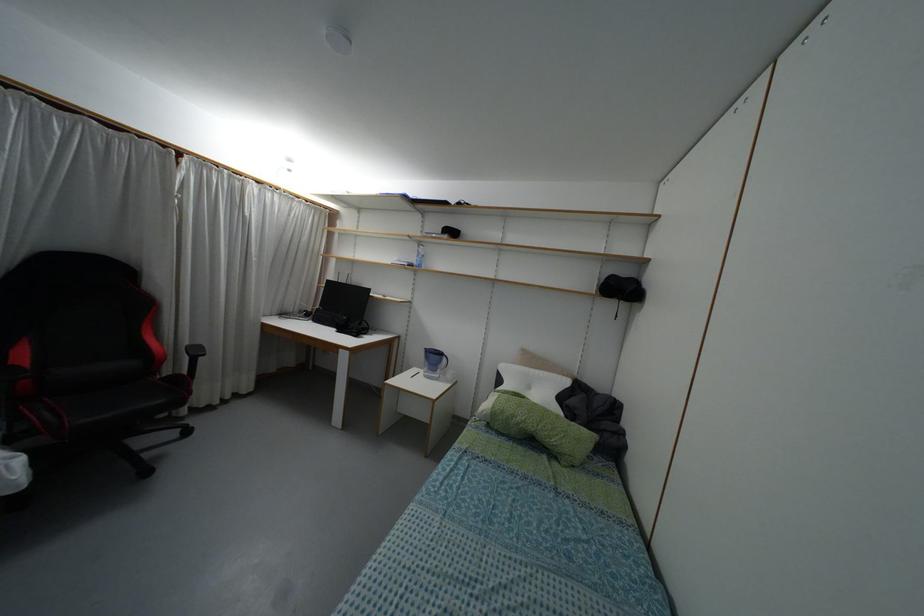
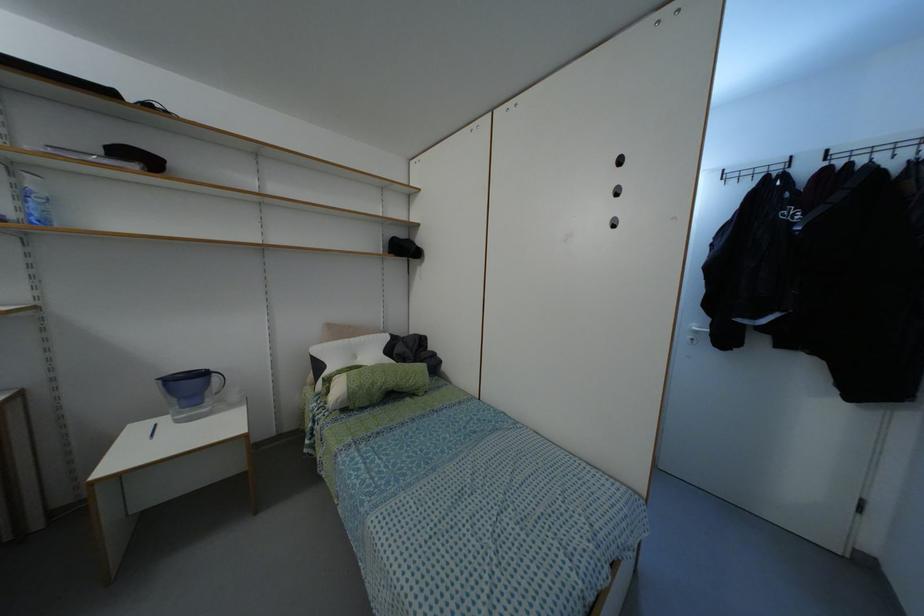
Find the pixel in the second image that matches the point at 512,416 in the first image.

(371, 384)